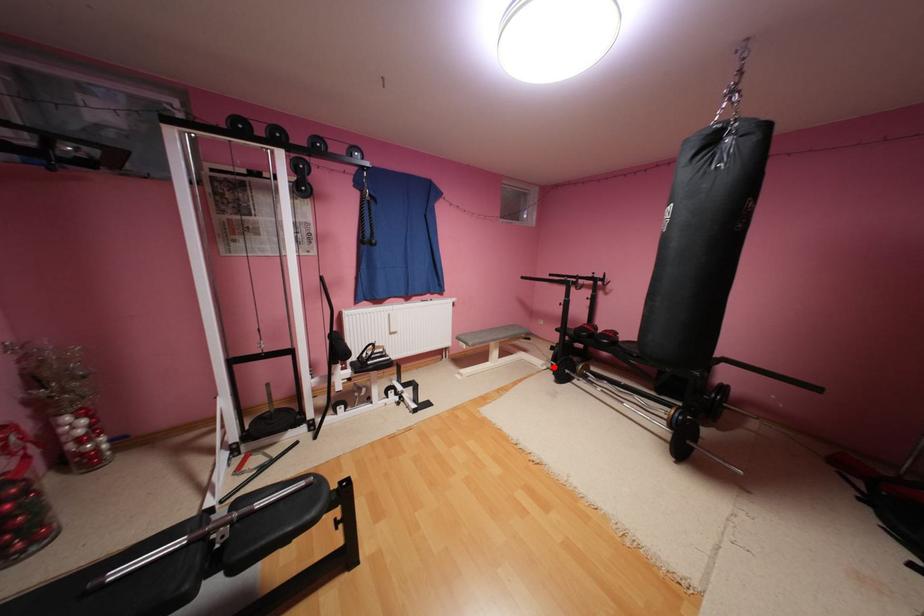
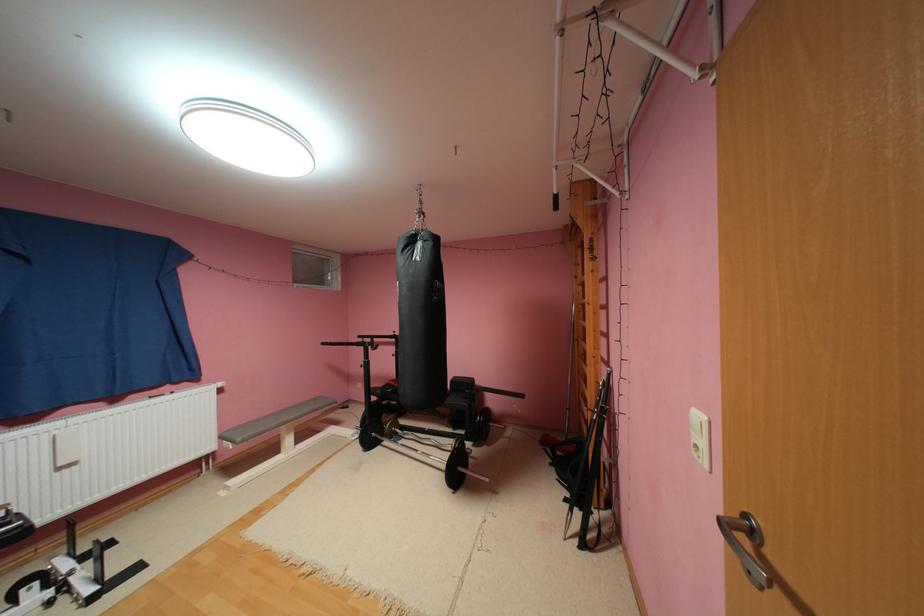
Question: I am providing you with two images of the same scene from different viewpoints. A red point is marked on the first image. Is the red point's position out of view in image 2?

Choices:
 (A) Yes
 (B) No

Answer: (B)